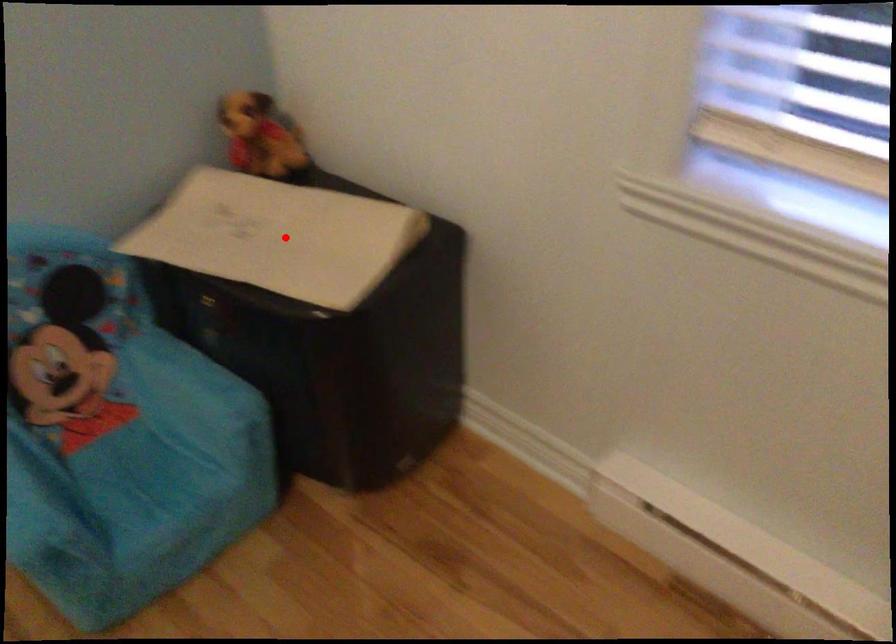
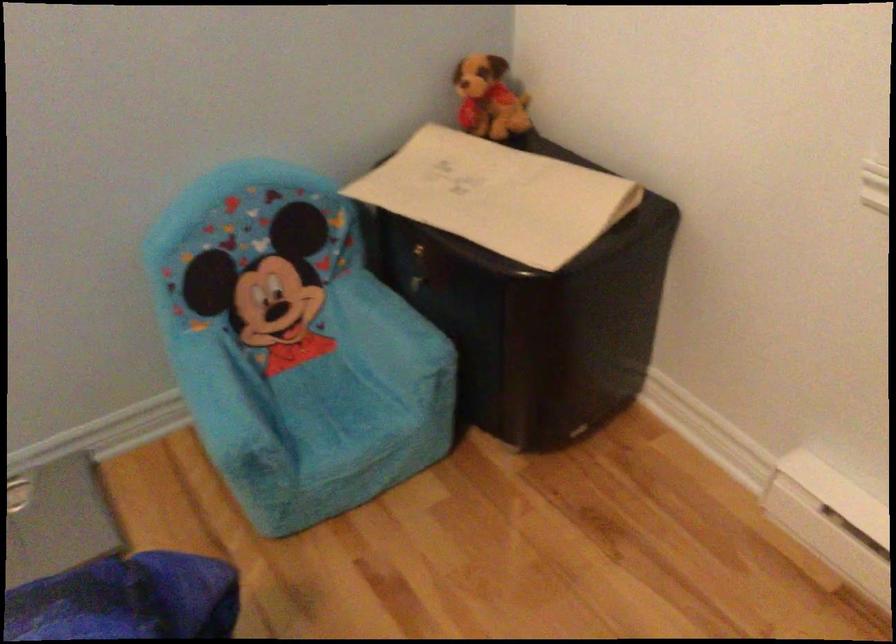
Find the pixel in the second image that matches the highlighted location in the first image.

(497, 196)